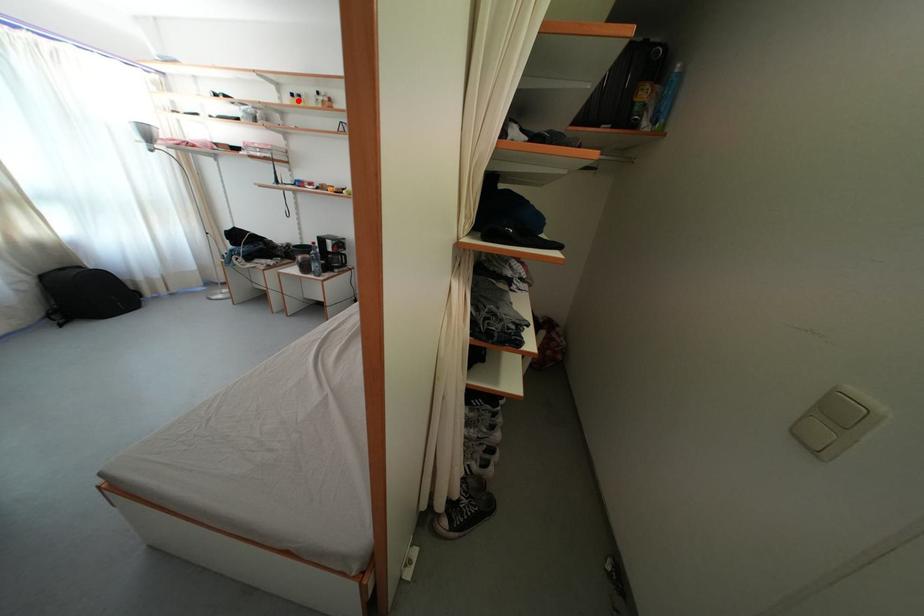
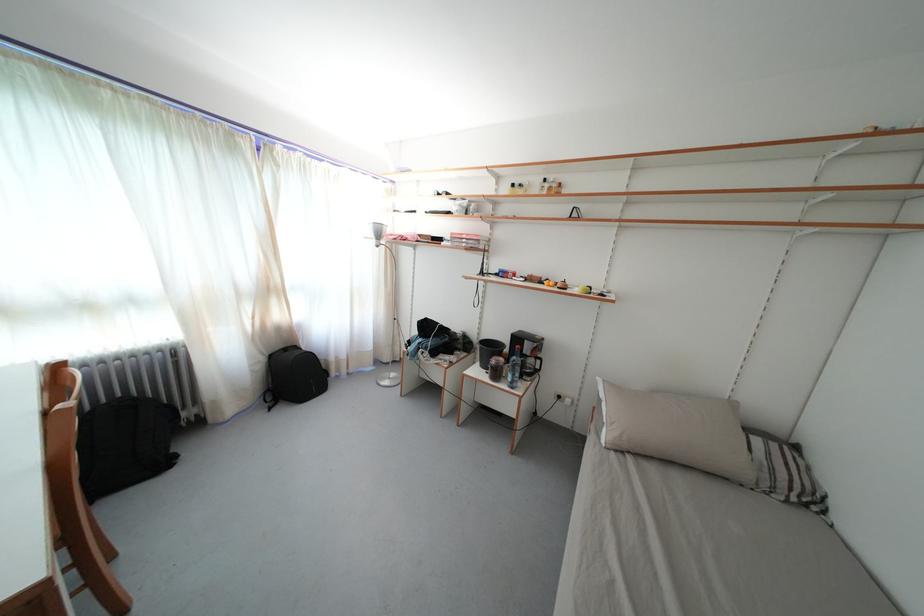
Find the pixel in the second image that matches the highlighted location in the first image.

(518, 191)